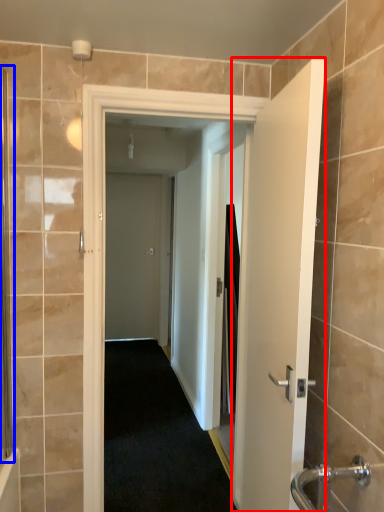
Question: Among these objects, which one is farthest to the camera, door (highlighted by a red box) or screen door (highlighted by a blue box)?

Choices:
 (A) door
 (B) screen door

Answer: (B)